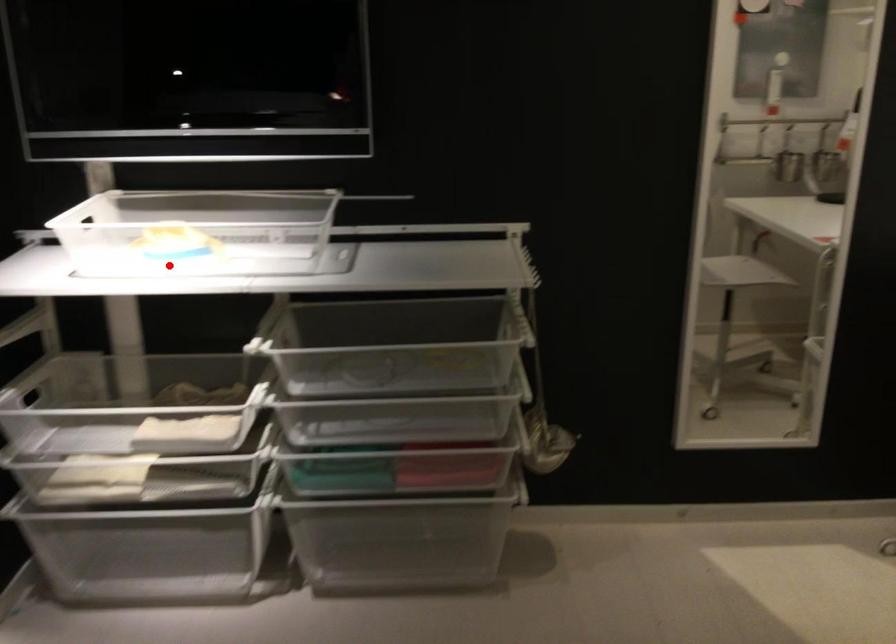
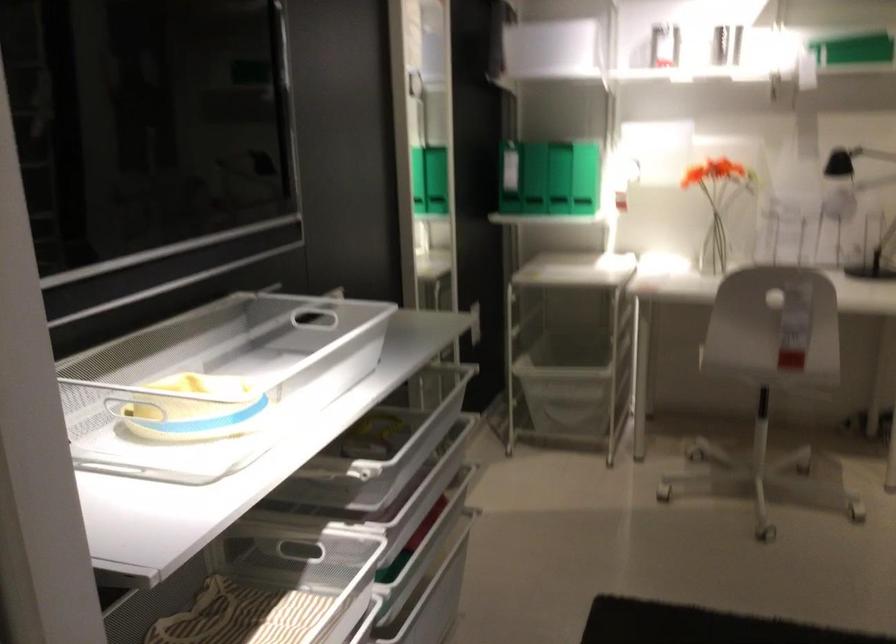
Locate, in the second image, the point that corresponds to the highlighted location in the first image.

(216, 383)